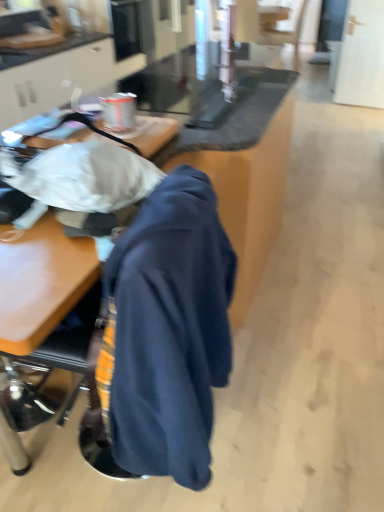
Question: From a real-world perspective, is black leather swivel chair at upper right on wooden table at center?

Choices:
 (A) no
 (B) yes

Answer: (B)

Question: Can you confirm if black leather swivel chair at upper right is thinner than wooden table at center?

Choices:
 (A) yes
 (B) no

Answer: (A)

Question: Is black leather swivel chair at upper right further to the viewer compared to wooden table at center?

Choices:
 (A) yes
 (B) no

Answer: (A)

Question: Is black leather swivel chair at upper right at the right side of wooden table at center?

Choices:
 (A) no
 (B) yes

Answer: (B)

Question: Is black leather swivel chair at upper right positioned before wooden table at center?

Choices:
 (A) no
 (B) yes

Answer: (A)

Question: Is navy blue hoodie at center situated inside wooden table at center or outside?

Choices:
 (A) outside
 (B) inside

Answer: (A)

Question: Is navy blue hoodie at center wider or thinner than wooden table at center?

Choices:
 (A) thin
 (B) wide

Answer: (A)

Question: Would you say navy blue hoodie at center is to the left or to the right of wooden table at center in the picture?

Choices:
 (A) left
 (B) right

Answer: (A)

Question: Considering the positions of navy blue hoodie at center and wooden table at center in the image, is navy blue hoodie at center taller or shorter than wooden table at center?

Choices:
 (A) short
 (B) tall

Answer: (A)

Question: Looking at their shapes, would you say wooden table at center is wider or thinner than navy blue hoodie at center?

Choices:
 (A) wide
 (B) thin

Answer: (A)

Question: In the image, is wooden table at center on the left side or the right side of navy blue hoodie at center?

Choices:
 (A) left
 (B) right

Answer: (B)

Question: Relative to navy blue hoodie at center, is wooden table at center in front or behind?

Choices:
 (A) front
 (B) behind

Answer: (B)

Question: From their relative heights in the image, would you say wooden table at center is taller or shorter than navy blue hoodie at center?

Choices:
 (A) tall
 (B) short

Answer: (A)

Question: Looking at their shapes, would you say navy blue hoodie at center is wider or thinner than black leather swivel chair at upper right?

Choices:
 (A) wide
 (B) thin

Answer: (B)

Question: From a real-world perspective, is navy blue hoodie at center physically located above or below black leather swivel chair at upper right?

Choices:
 (A) below
 (B) above

Answer: (B)